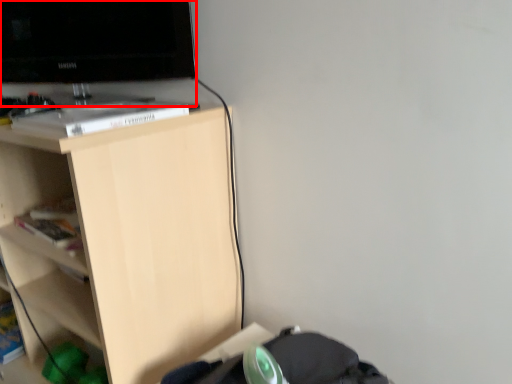
Question: From the image, what is the correct spatial relationship of television (annotated by the red box) in relation to shelf?

Choices:
 (A) right
 (B) left

Answer: (A)